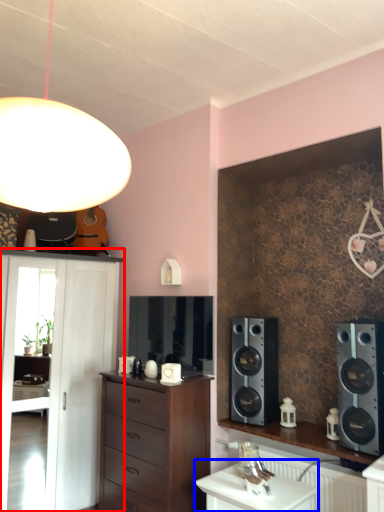
Question: Which object is further to the camera taking this photo, shelf (highlighted by a red box) or table (highlighted by a blue box)?

Choices:
 (A) shelf
 (B) table

Answer: (A)